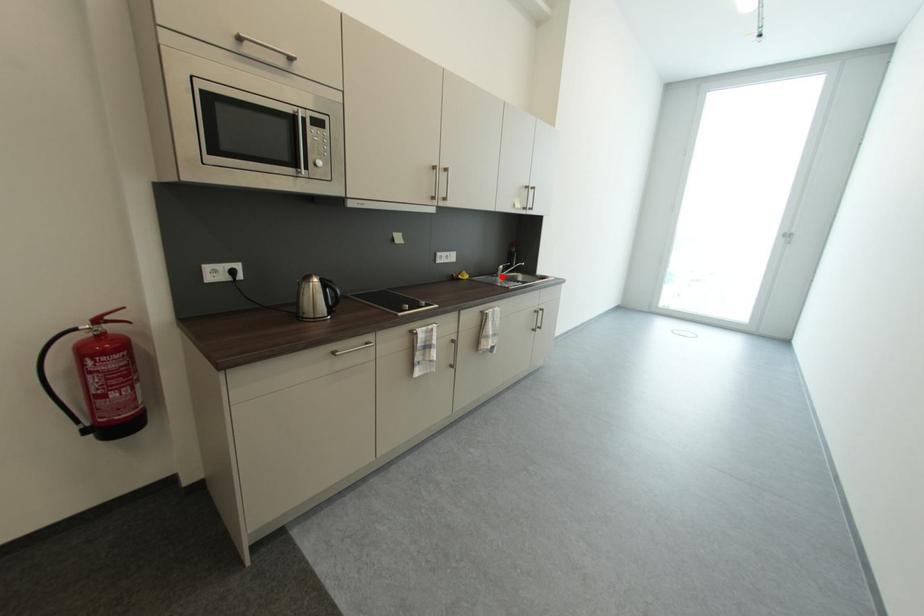
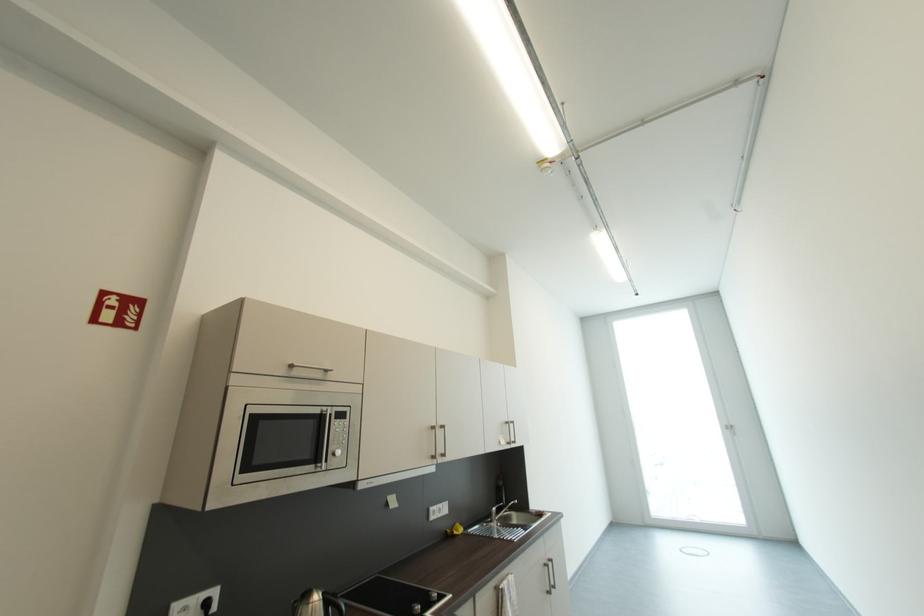
The point at the highlighted location is marked in the first image. Where is the corresponding point in the second image?

(495, 522)